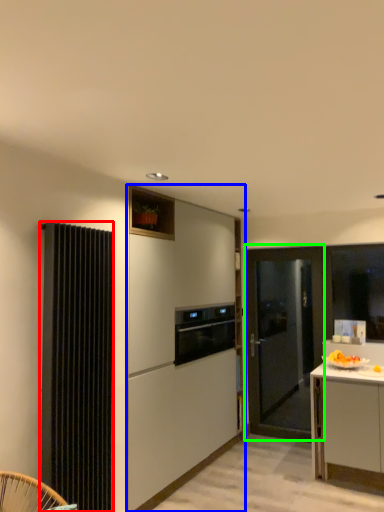
Question: Based on their relative distances, which object is nearer to radiator (highlighted by a red box)? Choose from cabinetry (highlighted by a blue box) and door (highlighted by a green box).

Choices:
 (A) cabinetry
 (B) door

Answer: (A)